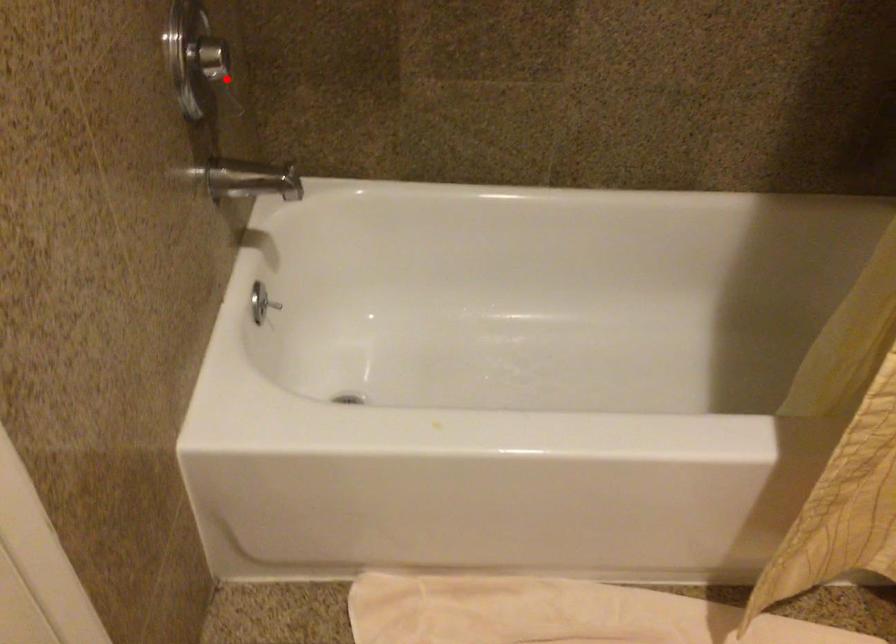
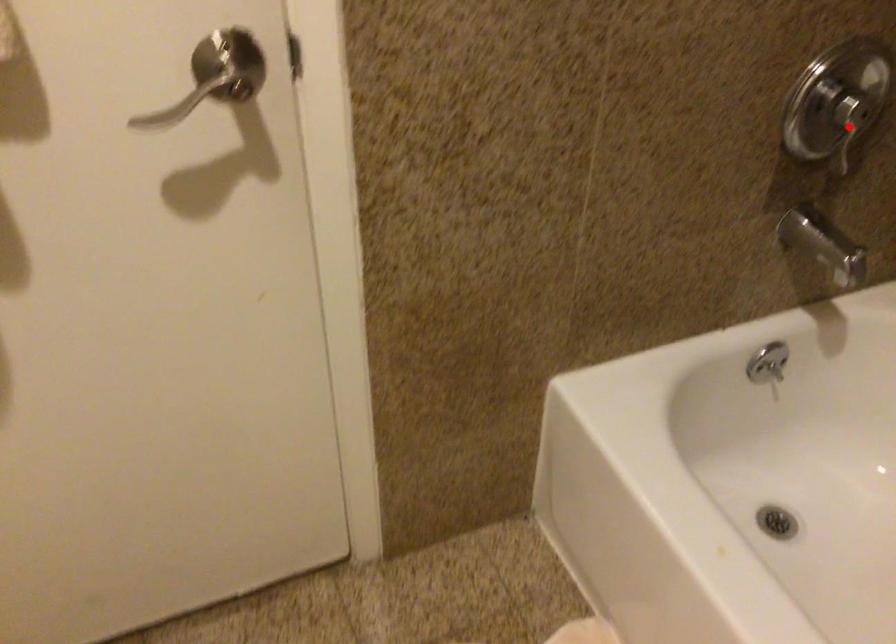
I am providing you with two images of the same scene from different viewpoints. A red point is marked on the first image and another point is marked on the second image. Do the highlighted points in image1 and image2 indicate the same real-world spot?

Yes